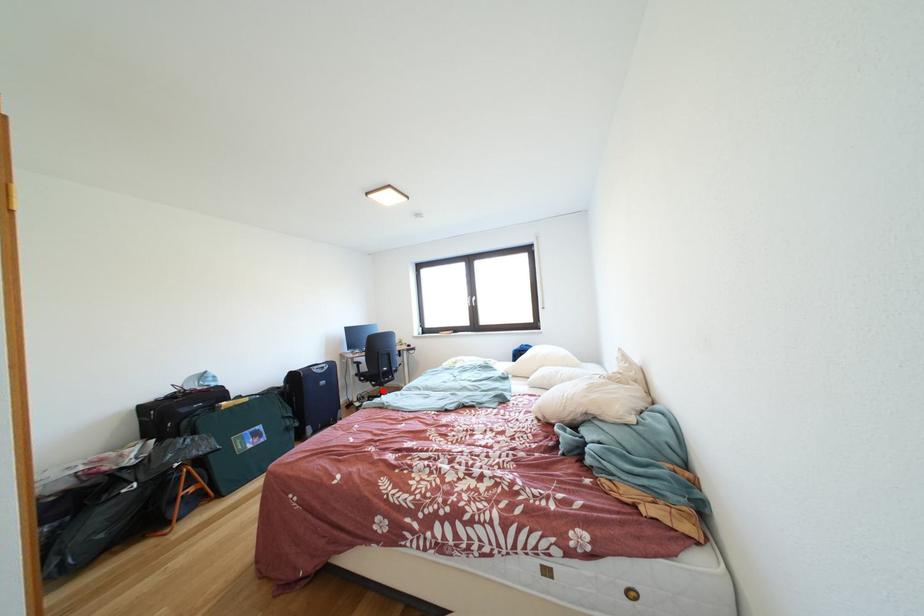
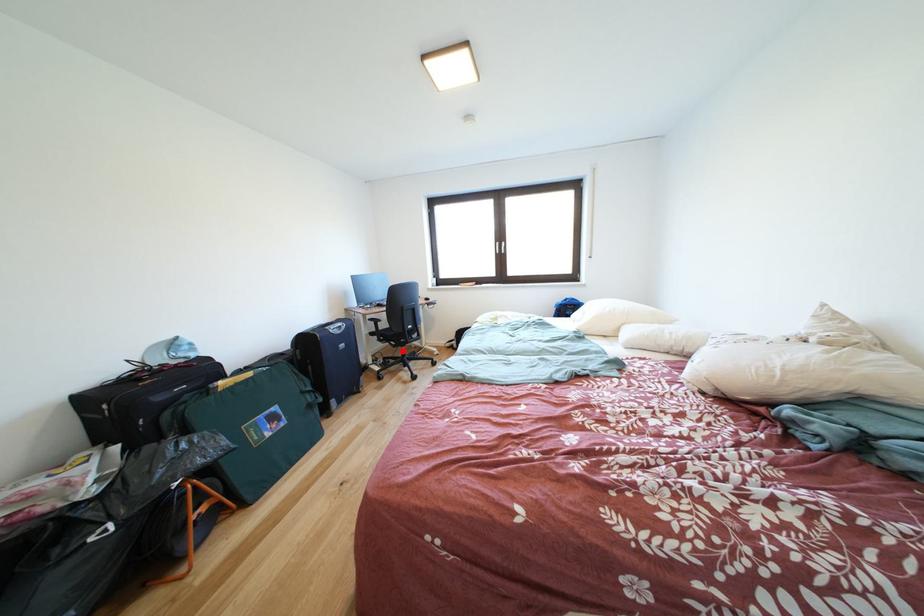
I am providing you with two images of the same scene from different viewpoints. A red point is marked on the first image and another point is marked on the second image. Does the point marked in image1 correspond to the same location as the one in image2?

Yes